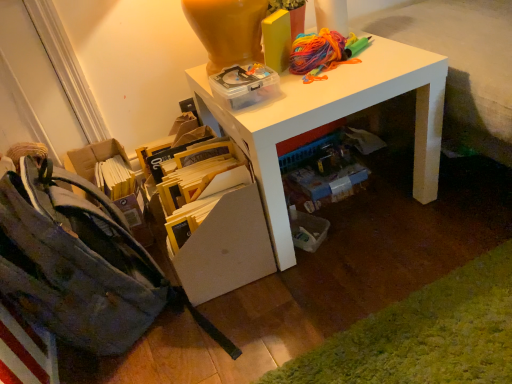
Locate an element on the screen. The width and height of the screenshot is (512, 384). free space in front of white glossy desk at upper center is located at coordinates (369, 292).